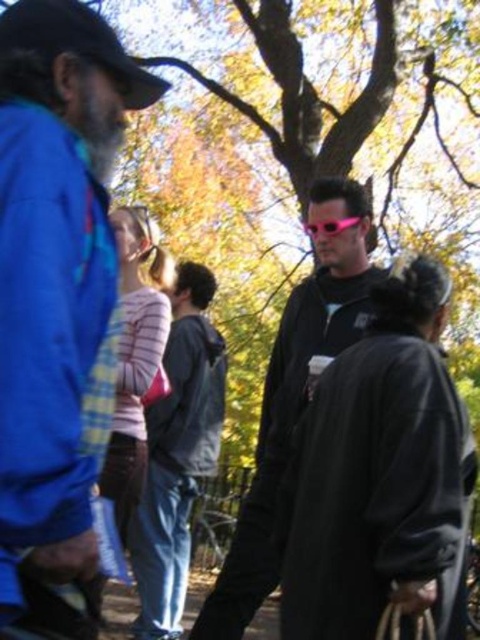
Question: Does blue fabric baseball cap at upper left have a smaller size compared to pink plastic goggles at center?

Choices:
 (A) no
 (B) yes

Answer: (A)

Question: Can you confirm if pink reflective sunglasses at center is positioned to the right of blue fabric baseball cap at upper left?

Choices:
 (A) yes
 (B) no

Answer: (A)

Question: In this image, where is matte blue jacket at left located relative to blue fabric baseball cap at upper left?

Choices:
 (A) left
 (B) right

Answer: (B)

Question: Which point appears closest to the camera in this image?

Choices:
 (A) tap(116, 51)
 (B) tap(265, 508)
 (C) tap(169, 480)
 (D) tap(330, 228)

Answer: (A)

Question: Estimate the real-world distances between objects in this image. Which object is farther from the blue fabric baseball cap at upper left?

Choices:
 (A) matte blue jacket at left
 (B) pink plastic goggles at center
 (C) pink reflective sunglasses at center

Answer: (C)

Question: Which point is closer to the camera?

Choices:
 (A) pink plastic goggles at center
 (B) matte blue jacket at left

Answer: (B)